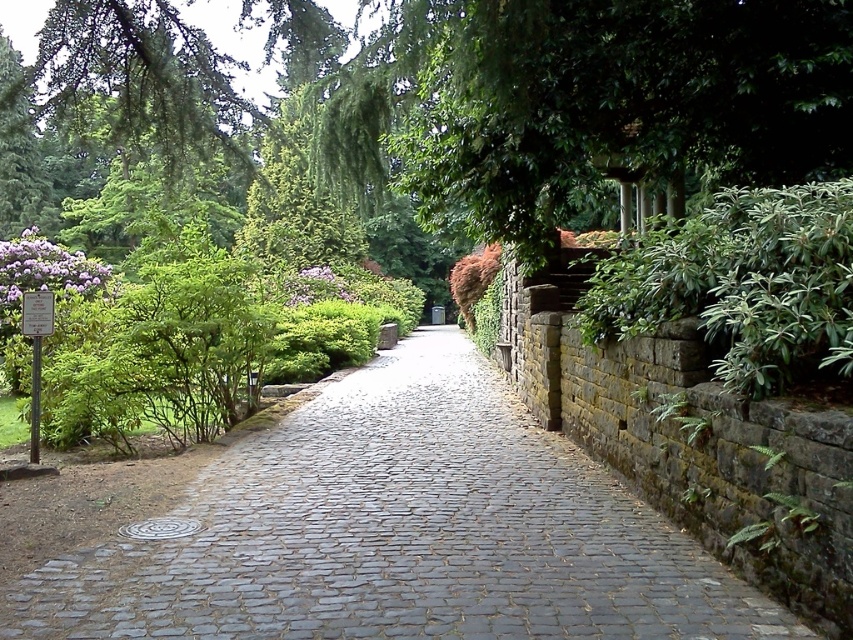
Does gray cobblestone pavement at center have a larger size compared to green leafy bush at right?

Indeed, gray cobblestone pavement at center has a larger size compared to green leafy bush at right.

Is gray cobblestone pavement at center wider than green leafy bush at right?

Indeed, gray cobblestone pavement at center has a greater width compared to green leafy bush at right.

What do you see at coordinates (401, 532) in the screenshot?
I see `gray cobblestone pavement at center` at bounding box center [401, 532].

The width and height of the screenshot is (853, 640). Identify the location of gray cobblestone pavement at center. (401, 532).